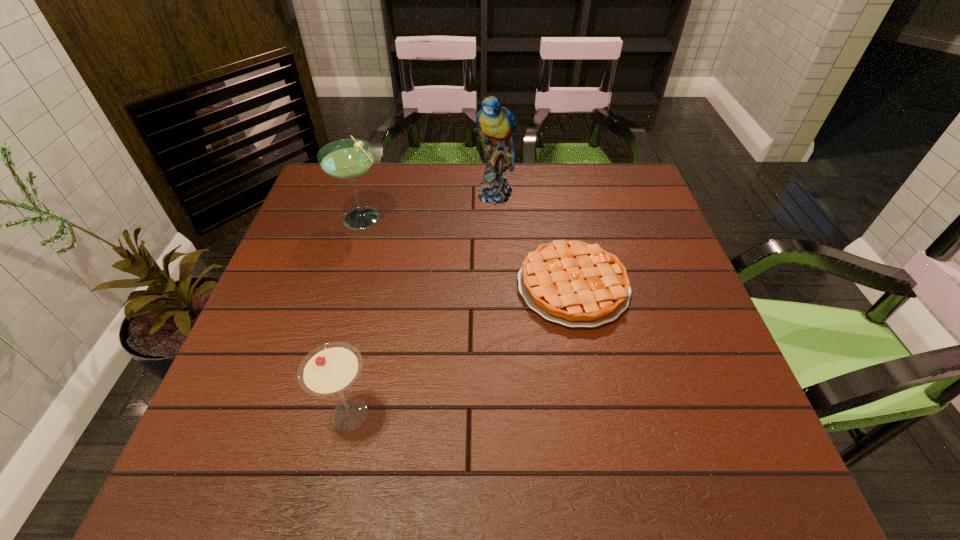
I want to click on vacant space located on the back of the shortest object, so click(562, 231).

Find the location of a particular element. parrot present at the far edge is located at coordinates (497, 125).

You are a GUI agent. You are given a task and a screenshot of the screen. Output one action in this format:
    pyautogui.click(x=<x>, y=<y>)
    Task: Click on the martini that is at the far edge
    The image size is (960, 540).
    Given the screenshot: What is the action you would take?
    pyautogui.click(x=347, y=159)

Locate an element on the screen. object located at the near edge is located at coordinates (329, 369).

Where is `object that is at the left edge`? object that is at the left edge is located at coordinates (347, 159).

Locate an element on the screen. This screenshot has width=960, height=540. object located at the right edge is located at coordinates (576, 284).

Locate an element on the screen. This screenshot has width=960, height=540. object at the far left corner is located at coordinates (347, 159).

At what (x,y) coordinates should I click in order to perform the action: click on vacant position at the far edge of the desktop. Please return your answer as a coordinate pair (x, y). Looking at the image, I should click on (556, 187).

In the image, there is a desktop. Identify the location of vacant space at the near edge. (420, 463).

Where is `free space at the left edge of the desktop`? Image resolution: width=960 pixels, height=540 pixels. free space at the left edge of the desktop is located at coordinates (x=284, y=274).